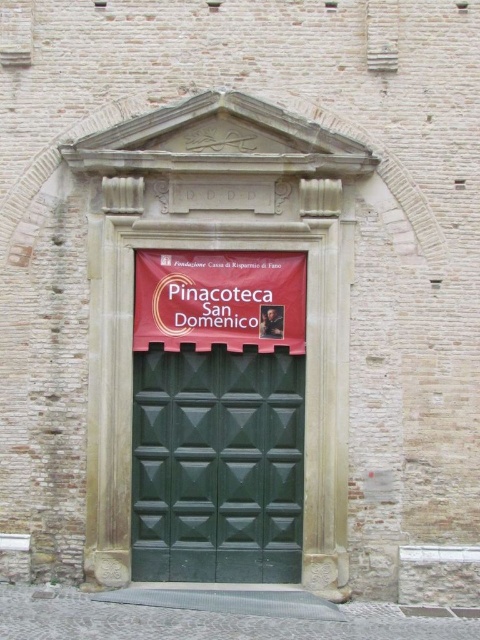
You are standing at the entrance of the Pinacoteca San Domenico and see two points marked on the door frame. Which point is closer to you, point at coordinate (x=176, y=445) or point at coordinate (x=288, y=268)?

Point at coordinate (x=288, y=268) is closer to you because point at coordinate (x=176, y=445) is behind it.

You are an art student trying to enter the Pinacoteca San Domenico. You see the green textured door at center and the red fabric banner at center. Which object is wider?

The green textured door at center is wider than the red fabric banner at center.

You are standing in front of the Pinacoteca San Domenico entrance. You need to hang a new sign that is 1.5 meters tall. The existing objects are the green textured door at center and the red fabric banner at center. Which object can accommodate the new sign in terms of height?

The green textured door at center is much taller than the red fabric banner at center, so the new sign that is 1.5 meters tall can be accommodated on the green textured door at center.